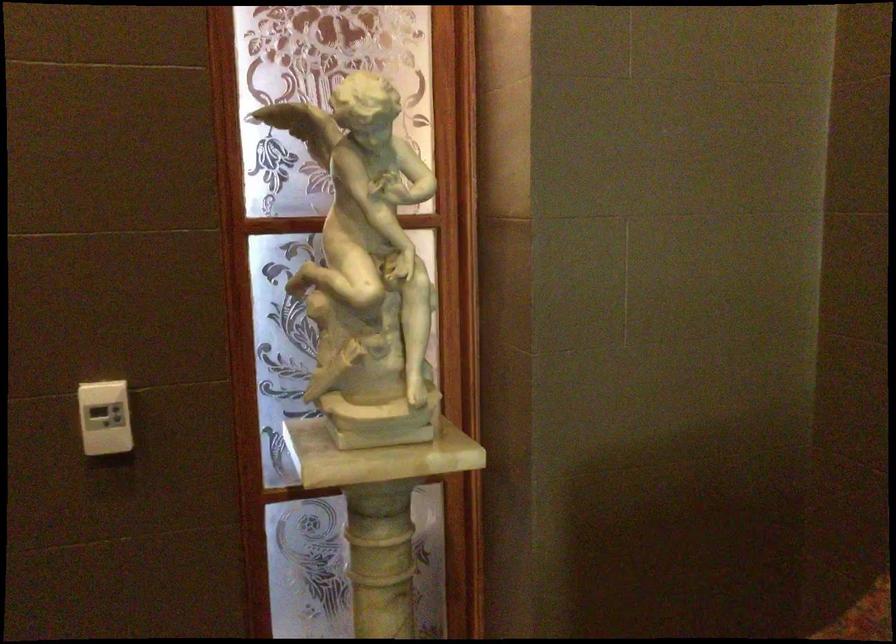
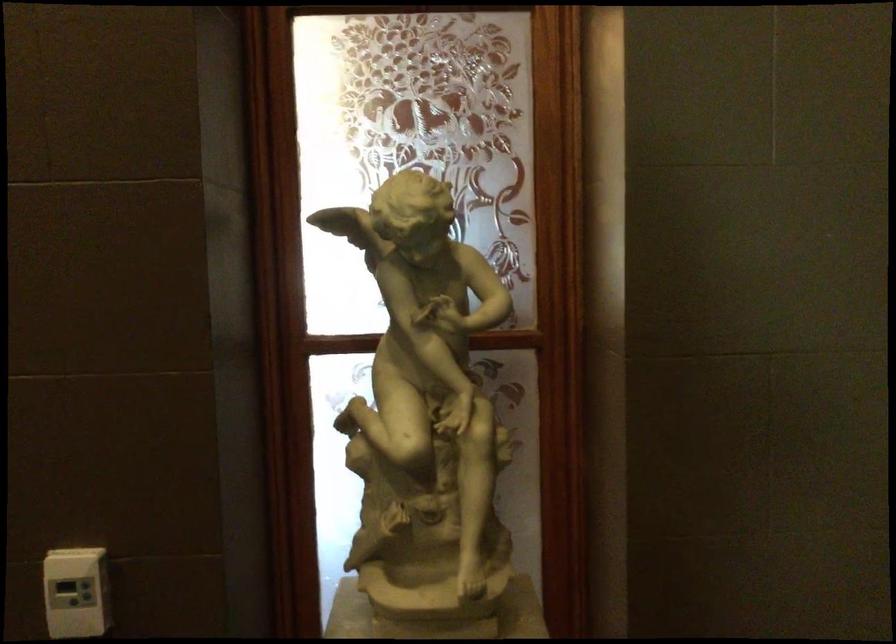
Question: How did the camera likely rotate?

Choices:
 (A) Left
 (B) Right
 (C) Up
 (D) Down

Answer: (A)